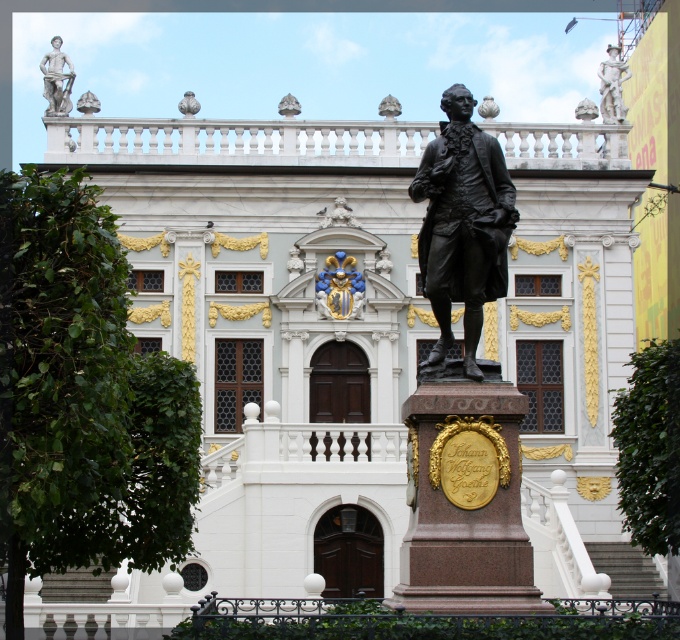
Does bronze statue at center appear on the right side of bronze statue at upper right?

No, bronze statue at center is not to the right of bronze statue at upper right.

Is bronze statue at center shorter than bronze statue at upper right?

No.

The image size is (680, 640). Identify the location of bronze statue at center. 462,225.

The image size is (680, 640). Identify the location of bronze statue at center. (462, 225).

Measure the distance between point (483,243) and camera.

The distance of point (483,243) from camera is 52.22 meters.

Identify the location of bronze statue at center. (462, 225).

Measure the distance between bronze statue at center and camera.

bronze statue at center is 52.04 meters away from camera.

This screenshot has height=640, width=680. In order to click on bronze statue at center in this screenshot , I will do `click(462, 225)`.

Does white marble statue at upper left have a greater width compared to bronze statue at upper right?

Indeed, white marble statue at upper left has a greater width compared to bronze statue at upper right.

This screenshot has height=640, width=680. Find the location of `white marble statue at upper left`. white marble statue at upper left is located at coordinates (56, 80).